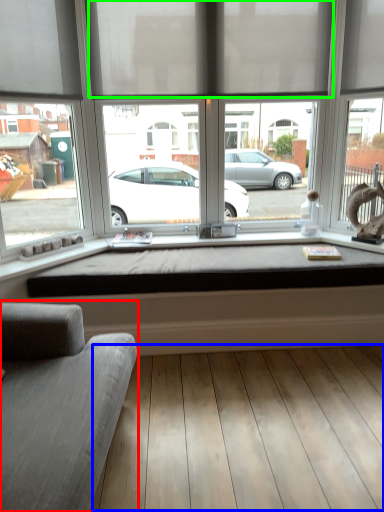
Question: Based on their relative distances, which object is farther from studio couch (highlighted by a red box)? Choose from plank (highlighted by a blue box) and curtain (highlighted by a green box).

Choices:
 (A) plank
 (B) curtain

Answer: (B)